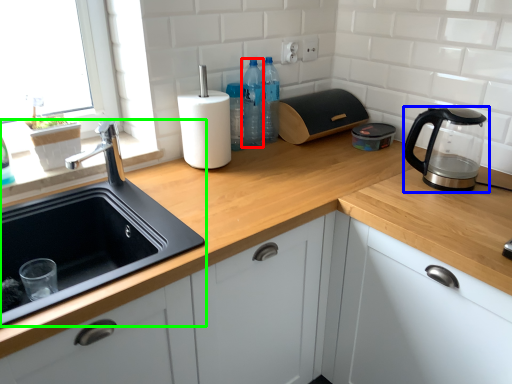
Question: Which is nearer to the bottle (highlighted by a red box)? home appliance (highlighted by a blue box) or sink (highlighted by a green box).

Choices:
 (A) home appliance
 (B) sink

Answer: (B)